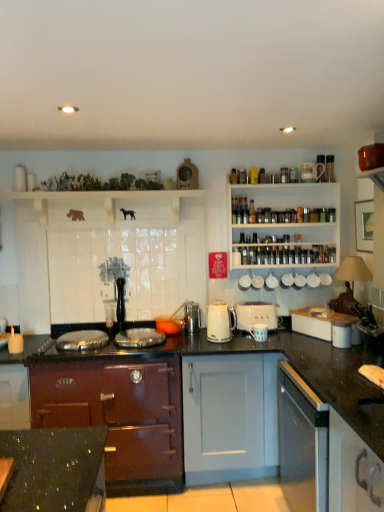
Question: From a real-world perspective, is orange glass bowl at center, placed as the 6th appliance when sorted from right to left, positioned over white glossy cup at upper right, which appears as the 1th appliance when viewed from the right, based on gravity?

Choices:
 (A) yes
 (B) no

Answer: (B)

Question: Considering the relative positions of orange glass bowl at center, which is the 1th appliance from left to right, and white glossy cup at upper right, acting as the 6th appliance starting from the left, in the image provided, is orange glass bowl at center, which is the 1th appliance from left to right, behind white glossy cup at upper right, acting as the 6th appliance starting from the left,?

Choices:
 (A) no
 (B) yes

Answer: (A)

Question: Can you confirm if orange glass bowl at center, which is the 1th appliance from left to right, is wider than white glossy cup at upper right, which appears as the 1th appliance when viewed from the right?

Choices:
 (A) yes
 (B) no

Answer: (A)

Question: Is orange glass bowl at center, which is the 1th appliance from left to right, taller than white glossy cup at upper right, acting as the 6th appliance starting from the left?

Choices:
 (A) yes
 (B) no

Answer: (B)

Question: Is orange glass bowl at center, placed as the 6th appliance when sorted from right to left, to the right of white glossy cup at upper right, which appears as the 1th appliance when viewed from the right, from the viewer's perspective?

Choices:
 (A) yes
 (B) no

Answer: (B)

Question: Does orange glass bowl at center, placed as the 6th appliance when sorted from right to left, appear on the left side of white glossy cup at upper right, which appears as the 1th appliance when viewed from the right?

Choices:
 (A) yes
 (B) no

Answer: (A)

Question: Is maroon wood stove at center, marked as the first cabinetry in a bottom-to-top arrangement, to the right of white ceramic mugs at upper center, placed as the second appliance when sorted from right to left, from the viewer's perspective?

Choices:
 (A) yes
 (B) no

Answer: (B)

Question: Can you see maroon wood stove at center, the 2th cabinetry positioned from the right, touching white ceramic mugs at upper center, the fifth appliance from the left?

Choices:
 (A) yes
 (B) no

Answer: (B)

Question: Considering the relative positions of maroon wood stove at center, the 2th cabinetry positioned from the right, and white ceramic mugs at upper center, the fifth appliance from the left, in the image provided, is maroon wood stove at center, the 2th cabinetry positioned from the right, behind white ceramic mugs at upper center, the fifth appliance from the left,?

Choices:
 (A) yes
 (B) no

Answer: (B)

Question: Does maroon wood stove at center, arranged as the first cabinetry when viewed from the left, have a lesser width compared to white ceramic mugs at upper center, the fifth appliance from the left?

Choices:
 (A) yes
 (B) no

Answer: (B)

Question: Is white ceramic mugs at upper center, placed as the second appliance when sorted from right to left, completely or partially inside maroon wood stove at center, the 2th cabinetry positioned from the right?

Choices:
 (A) no
 (B) yes

Answer: (A)

Question: Is maroon wood stove at center, arranged as the first cabinetry when viewed from the left, outside white ceramic mugs at upper center, placed as the second appliance when sorted from right to left?

Choices:
 (A) yes
 (B) no

Answer: (A)

Question: Does metallic silver toaster at center, which is counted as the second appliance, starting from the left, appear on the right side of white plastic toaster at center-right, acting as the 4th appliance starting from the left?

Choices:
 (A) yes
 (B) no

Answer: (B)